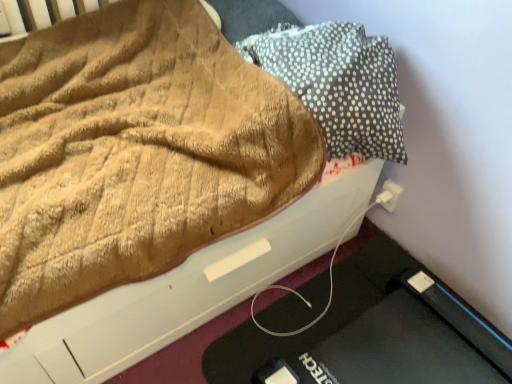
Locate an element on the screen. This screenshot has width=512, height=384. dark gray dotted pillow at upper right is located at coordinates (338, 83).

Measure the distance between dark gray dotted pillow at upper right and camera.

dark gray dotted pillow at upper right is 3.39 feet from camera.

The image size is (512, 384). What do you see at coordinates (338, 83) in the screenshot?
I see `dark gray dotted pillow at upper right` at bounding box center [338, 83].

What is the approximate width of white plastic electric outlet at lower right?

white plastic electric outlet at lower right is 0.92 inches in width.

Describe the element at coordinates (389, 195) in the screenshot. I see `white plastic electric outlet at lower right` at that location.

At what (x,y) coordinates should I click in order to perform the action: click on white plastic electric outlet at lower right. Please return your answer as a coordinate pair (x, y). The image size is (512, 384). Looking at the image, I should click on (389, 195).

Locate an element on the screen. The image size is (512, 384). dark gray dotted pillow at upper right is located at coordinates (338, 83).

From the picture: Based on their positions, is dark gray dotted pillow at upper right located to the left or right of white plastic electric outlet at lower right?

From the image, it's evident that dark gray dotted pillow at upper right is to the left of white plastic electric outlet at lower right.

Does dark gray dotted pillow at upper right come behind white plastic electric outlet at lower right?

No, it is in front of white plastic electric outlet at lower right.

Which point is more distant from viewer, (353, 118) or (392, 188)?

Positioned behind is point (392, 188).

From the image's perspective, is dark gray dotted pillow at upper right beneath white plastic electric outlet at lower right?

Actually, dark gray dotted pillow at upper right appears above white plastic electric outlet at lower right in the image.

From a real-world perspective, is dark gray dotted pillow at upper right physically above white plastic electric outlet at lower right?

Yes, from a real-world perspective, dark gray dotted pillow at upper right is on top of white plastic electric outlet at lower right.

Does dark gray dotted pillow at upper right have a lesser width compared to white plastic electric outlet at lower right?

In fact, dark gray dotted pillow at upper right might be wider than white plastic electric outlet at lower right.

Is dark gray dotted pillow at upper right taller than white plastic electric outlet at lower right?

Correct, dark gray dotted pillow at upper right is much taller as white plastic electric outlet at lower right.

Which of these two, dark gray dotted pillow at upper right or white plastic electric outlet at lower right, is smaller?

white plastic electric outlet at lower right is smaller.

Is dark gray dotted pillow at upper right not inside white plastic electric outlet at lower right?

That's correct, dark gray dotted pillow at upper right is outside of white plastic electric outlet at lower right.

Are dark gray dotted pillow at upper right and white plastic electric outlet at lower right far apart?

No, dark gray dotted pillow at upper right is not far from white plastic electric outlet at lower right.

Could you tell me if dark gray dotted pillow at upper right is facing white plastic electric outlet at lower right?

No.

How many degrees apart are the facing directions of dark gray dotted pillow at upper right and white plastic electric outlet at lower right?

The angular difference between dark gray dotted pillow at upper right and white plastic electric outlet at lower right is 2.92 degrees.

The image size is (512, 384). In the image, there is a dark gray dotted pillow at upper right. Identify the location of electric outlet below it (from the image's perspective). (389, 195).

Visually, is white plastic electric outlet at lower right positioned to the left or to the right of dark gray dotted pillow at upper right?

Clearly, white plastic electric outlet at lower right is on the right of dark gray dotted pillow at upper right in the image.

Which object is further away from the camera taking this photo, white plastic electric outlet at lower right or dark gray dotted pillow at upper right?

Positioned behind is white plastic electric outlet at lower right.

Considering the positions of points (402, 188) and (362, 125), is point (402, 188) closer to camera compared to point (362, 125)?

No, it is behind (362, 125).

From the image's perspective, between white plastic electric outlet at lower right and dark gray dotted pillow at upper right, which one is located above?

From the image's view, dark gray dotted pillow at upper right is above.

In the scene shown: From a real-world perspective, which is physically above, white plastic electric outlet at lower right or dark gray dotted pillow at upper right?

dark gray dotted pillow at upper right is physically above.

Which of these two, white plastic electric outlet at lower right or dark gray dotted pillow at upper right, is wider?

With larger width is dark gray dotted pillow at upper right.

Considering the relative sizes of white plastic electric outlet at lower right and dark gray dotted pillow at upper right in the image provided, is white plastic electric outlet at lower right shorter than dark gray dotted pillow at upper right?

Yes, white plastic electric outlet at lower right is shorter than dark gray dotted pillow at upper right.

Does white plastic electric outlet at lower right have a larger size compared to dark gray dotted pillow at upper right?

Incorrect, white plastic electric outlet at lower right is not larger than dark gray dotted pillow at upper right.

Would you say white plastic electric outlet at lower right is inside or outside dark gray dotted pillow at upper right?

white plastic electric outlet at lower right lies outside dark gray dotted pillow at upper right.

Is white plastic electric outlet at lower right far from dark gray dotted pillow at upper right?

No.

Could you tell me if white plastic electric outlet at lower right is turned towards dark gray dotted pillow at upper right?

No, white plastic electric outlet at lower right is not oriented towards dark gray dotted pillow at upper right.

What's the angular difference between white plastic electric outlet at lower right and dark gray dotted pillow at upper right's facing directions?

2.92 degrees.

Measure the distance from white plastic electric outlet at lower right to dark gray dotted pillow at upper right.

They are 43.49 centimeters apart.

This screenshot has height=384, width=512. Find the location of `electric outlet behind the dark gray dotted pillow at upper right`. electric outlet behind the dark gray dotted pillow at upper right is located at coordinates (389, 195).

You are a GUI agent. You are given a task and a screenshot of the screen. Output one action in this format:
    pyautogui.click(x=<x>, y=<y>)
    Task: Click on the electric outlet on the right of dark gray dotted pillow at upper right
    This screenshot has height=384, width=512.
    Given the screenshot: What is the action you would take?
    pyautogui.click(x=389, y=195)

In order to click on pillow above the white plastic electric outlet at lower right (from the image's perspective) in this screenshot , I will do `click(338, 83)`.